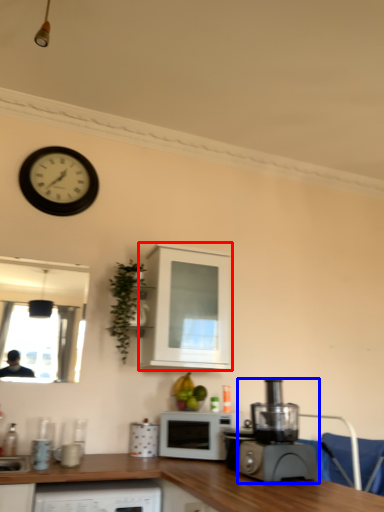
Question: Among these objects, which one is nearest to the camera, cabinetry (highlighted by a red box) or home appliance (highlighted by a blue box)?

Choices:
 (A) cabinetry
 (B) home appliance

Answer: (B)